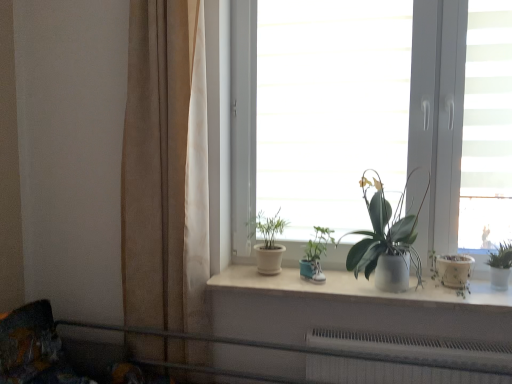
Question: Which direction should I rotate to look at green matte plant at center, acting as the 3th houseplant starting from the left, — up or down?

Choices:
 (A) up
 (B) down

Answer: (B)

Question: Does burlap curtain at left have a smaller size compared to metallic gray rail at lower center?

Choices:
 (A) no
 (B) yes

Answer: (B)

Question: Is burlap curtain at left looking in the opposite direction of metallic gray rail at lower center?

Choices:
 (A) no
 (B) yes

Answer: (A)

Question: Is burlap curtain at left to the left of metallic gray rail at lower center from the viewer's perspective?

Choices:
 (A) no
 (B) yes

Answer: (B)

Question: Is burlap curtain at left with metallic gray rail at lower center?

Choices:
 (A) yes
 (B) no

Answer: (B)

Question: Can you confirm if burlap curtain at left is thinner than metallic gray rail at lower center?

Choices:
 (A) no
 (B) yes

Answer: (B)

Question: From the image's perspective, is burlap curtain at left below metallic gray rail at lower center?

Choices:
 (A) no
 (B) yes

Answer: (A)

Question: From the image's perspective, is matte white pot at center, which ranks as the first houseplant in left-to-right order, beneath green glossy plant at right, which ranks as the first houseplant in right-to-left order?

Choices:
 (A) no
 (B) yes

Answer: (A)

Question: Does matte white pot at center, marked as the fourth houseplant in a right-to-left arrangement, have a greater width compared to green glossy plant at right, which ranks as the 4th houseplant in left-to-right order?

Choices:
 (A) yes
 (B) no

Answer: (A)

Question: Is matte white pot at center, which ranks as the first houseplant in left-to-right order, facing away from green glossy plant at right, which ranks as the 4th houseplant in left-to-right order?

Choices:
 (A) no
 (B) yes

Answer: (A)

Question: Can you confirm if matte white pot at center, which ranks as the first houseplant in left-to-right order, is smaller than green glossy plant at right, which ranks as the 4th houseplant in left-to-right order?

Choices:
 (A) no
 (B) yes

Answer: (A)

Question: Is green glossy plant at right, which ranks as the 4th houseplant in left-to-right order, surrounded by matte white pot at center, marked as the fourth houseplant in a right-to-left arrangement?

Choices:
 (A) yes
 (B) no

Answer: (B)

Question: Does matte white pot at center, marked as the fourth houseplant in a right-to-left arrangement, come behind green glossy plant at right, which ranks as the 4th houseplant in left-to-right order?

Choices:
 (A) yes
 (B) no

Answer: (A)

Question: Considering the relative positions of matte white pot at center, which ranks as the first houseplant in left-to-right order, and burlap curtain at left in the image provided, is matte white pot at center, which ranks as the first houseplant in left-to-right order, to the left of burlap curtain at left from the viewer's perspective?

Choices:
 (A) no
 (B) yes

Answer: (A)